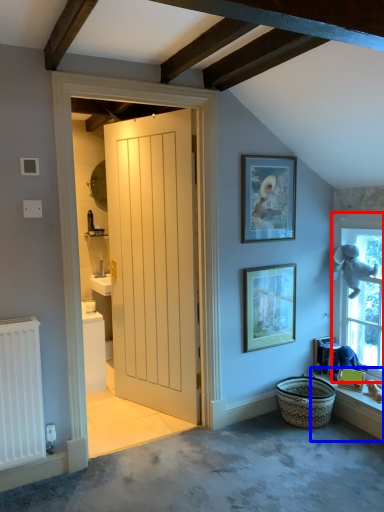
Question: Among these objects, which one is farthest to the camera, window (highlighted by a red box) or window sill (highlighted by a blue box)?

Choices:
 (A) window
 (B) window sill

Answer: (A)